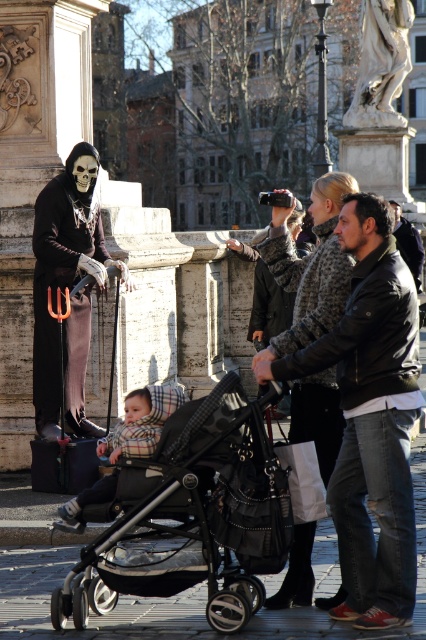
Question: Is matte black skeleton at left to the left of plaid fabric baby carriage at center from the viewer's perspective?

Choices:
 (A) no
 (B) yes

Answer: (B)

Question: Does matte black skeleton at left appear over leather jacket at center?

Choices:
 (A) no
 (B) yes

Answer: (B)

Question: Which of the following is the closest to the observer?

Choices:
 (A) (62, 509)
 (B) (68, 272)
 (C) (350, 113)

Answer: (A)

Question: Considering the real-world distances, which object is closest to the white marble statue at upper center?

Choices:
 (A) matte black skeleton at left
 (B) plaid fabric baby carriage at center
 (C) silver metallic stroller at center

Answer: (A)

Question: Can you confirm if silver metallic stroller at center is positioned below plaid fabric baby carriage at center?

Choices:
 (A) no
 (B) yes

Answer: (B)

Question: Which object is farther from the camera taking this photo?

Choices:
 (A) matte black skeleton at left
 (B) white marble statue at upper center

Answer: (B)